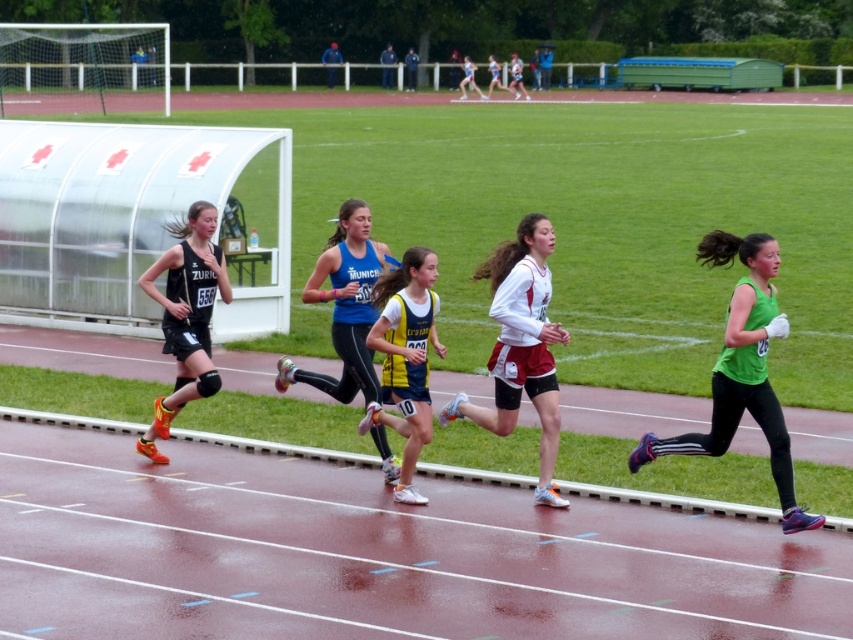
You are a photographer positioned at the starting line of the track race. You want to capture a closeup shot of the athlete wearing the white matte running uniform at center. To do this, you need to zoom in on the point marked at coordinates point (521, 346). Will this point be located on the athlete wearing the white matte running uniform at center?

Yes, the point (521, 346) is on the white matte running uniform at center, so zooming in on this point will capture the athlete wearing the white matte running uniform at center.

You are a photographer positioned at the starting line of the track race. You need to capture a photo that includes both the matte black shorts at left and the yellow and blue jersey at center. Considering their widths, which athlete should you frame closer to the lens to ensure both fit in the shot?

Since the matte black shorts at left are wider than the yellow and blue jersey at center, you should frame the matte black shorts at left closer to the lens to accommodate their greater width, ensuring both fit within the photo.

You are a photographer positioned at the starting line of the track race. You want to take a photo that includes both the green matte tank top at right and the blue fabric tank top at center. Which athlete should you focus on first to ensure both are in the frame?

You should focus on the green matte tank top at right first because it is closer to the viewer than the blue fabric tank top at center, allowing both to be captured in the frame.